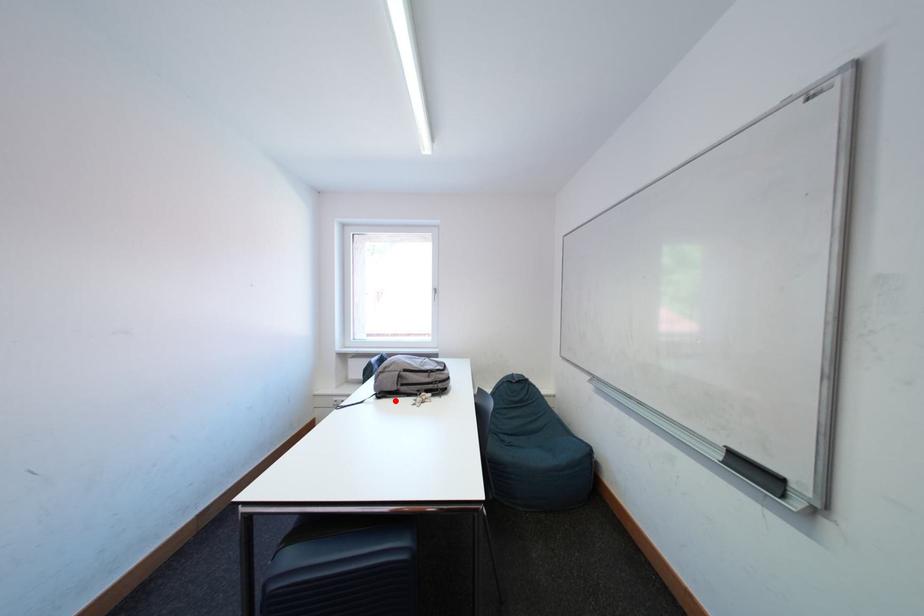
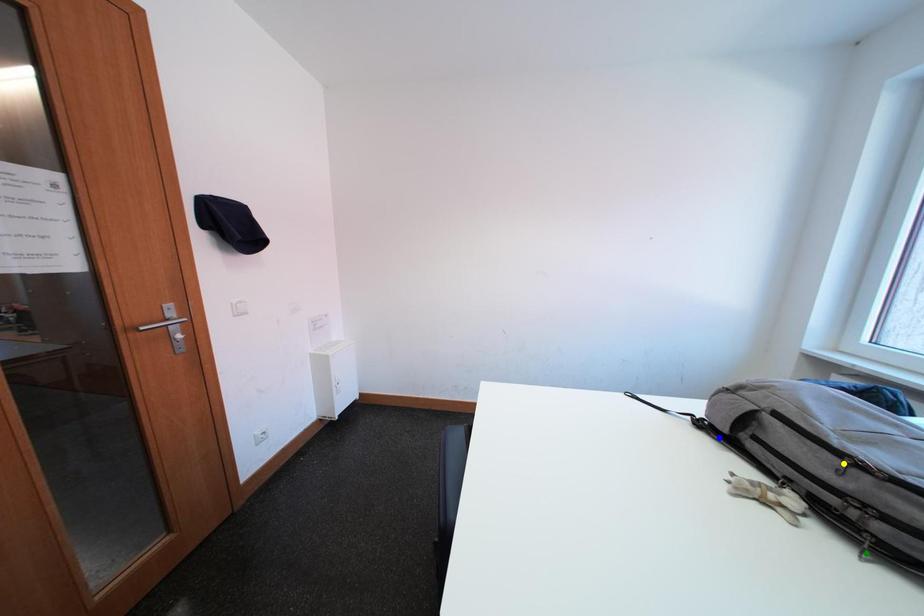
Question: I am providing you with two images of the same scene from different viewpoints. A red point is marked on the first image. You are given multiple points on the second image. Which point in image 2 is actually the same real-world point as the red point in image 1?

Choices:
 (A) green point
 (B) yellow point
 (C) blue point

Answer: (C)